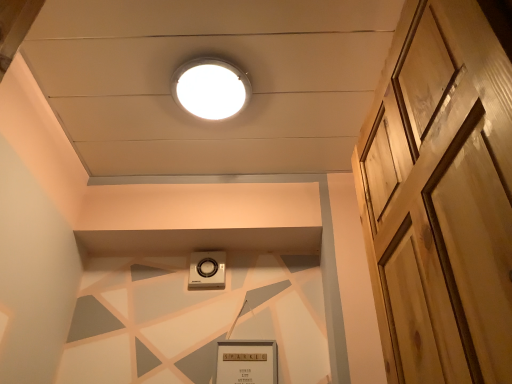
Question: Does white glossy droplight at upper center have a greater height compared to white plastic thermostat at center?

Choices:
 (A) yes
 (B) no

Answer: (B)

Question: From a real-world perspective, is white glossy droplight at upper center positioned under white plastic thermostat at center based on gravity?

Choices:
 (A) no
 (B) yes

Answer: (A)

Question: Considering the relative positions of white glossy droplight at upper center and white plastic thermostat at center in the image provided, is white glossy droplight at upper center to the right of white plastic thermostat at center from the viewer's perspective?

Choices:
 (A) no
 (B) yes

Answer: (B)

Question: Are white glossy droplight at upper center and white plastic thermostat at center making contact?

Choices:
 (A) yes
 (B) no

Answer: (B)

Question: Is white glossy droplight at upper center bigger than white plastic thermostat at center?

Choices:
 (A) no
 (B) yes

Answer: (B)

Question: Considering the relative sizes of white glossy droplight at upper center and white plastic thermostat at center in the image provided, is white glossy droplight at upper center shorter than white plastic thermostat at center?

Choices:
 (A) yes
 (B) no

Answer: (A)

Question: Considering the relative sizes of light brown wooden door at right and white plastic thermostat at center in the image provided, is light brown wooden door at right shorter than white plastic thermostat at center?

Choices:
 (A) no
 (B) yes

Answer: (A)

Question: From the image's perspective, is light brown wooden door at right beneath white plastic thermostat at center?

Choices:
 (A) no
 (B) yes

Answer: (A)

Question: Is white plastic thermostat at center inside light brown wooden door at right?

Choices:
 (A) no
 (B) yes

Answer: (A)

Question: From the image's perspective, is light brown wooden door at right over white plastic thermostat at center?

Choices:
 (A) yes
 (B) no

Answer: (A)

Question: Can you confirm if light brown wooden door at right is positioned to the right of white plastic thermostat at center?

Choices:
 (A) no
 (B) yes

Answer: (B)

Question: Can you confirm if light brown wooden door at right is taller than white plastic thermostat at center?

Choices:
 (A) no
 (B) yes

Answer: (B)

Question: Does white plastic thermostat at center have a greater height compared to light brown wooden door at right?

Choices:
 (A) yes
 (B) no

Answer: (B)